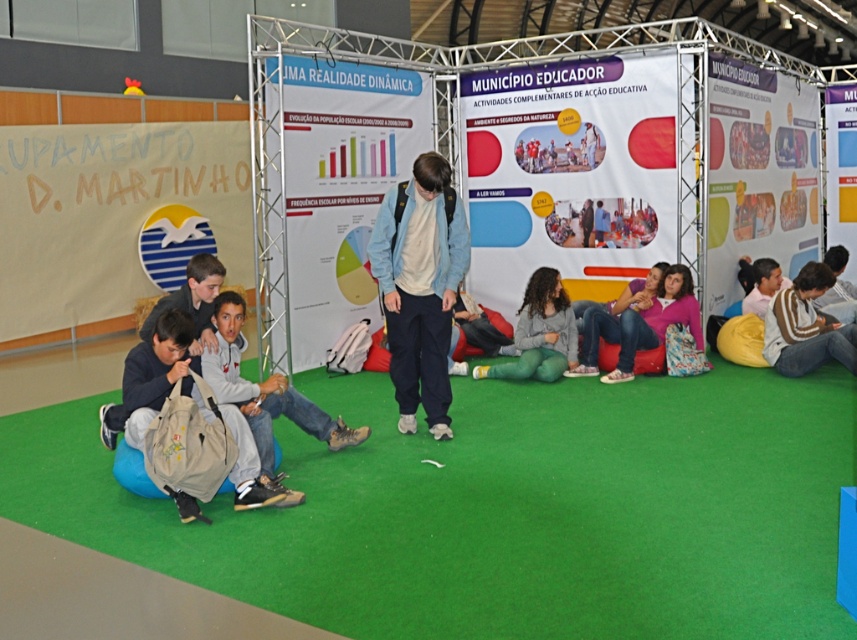
Question: Can you confirm if khaki canvas backpack at lower left is smaller than brown striped sweater at right?

Choices:
 (A) yes
 (B) no

Answer: (B)

Question: Which point appears farthest from the camera in this image?

Choices:
 (A) (262, 458)
 (B) (193, 513)
 (C) (586, 353)

Answer: (C)

Question: Which object appears farthest from the camera in this image?

Choices:
 (A) gray fleece sweater at center
 (B) brown striped sweater at right
 (C) khaki canvas backpack at lower left

Answer: (A)

Question: Is khaki canvas backpack at lower left smaller than gray fleece sweater at center?

Choices:
 (A) yes
 (B) no

Answer: (B)

Question: Which of the following is the closest to the observer?

Choices:
 (A) (818, 320)
 (B) (526, 298)
 (C) (219, 387)
 (D) (196, 392)

Answer: (D)

Question: Is the position of denim jacket at center more distant than that of brown striped sweater at right?

Choices:
 (A) no
 (B) yes

Answer: (A)